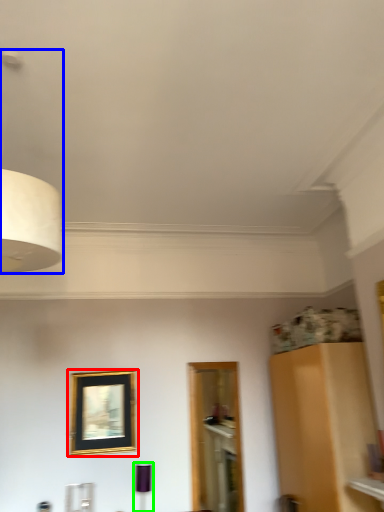
Question: Which object is the farthest from picture frame (highlighted by a red box)? Choose among these: lamp (highlighted by a blue box) or lamp (highlighted by a green box).

Choices:
 (A) lamp
 (B) lamp

Answer: (A)